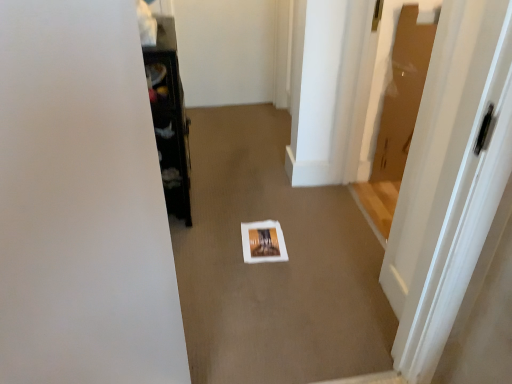
Question: From a real-world perspective, is white glossy door at center right above or below white paper at center?

Choices:
 (A) above
 (B) below

Answer: (A)

Question: In terms of height, does white glossy door at center right look taller or shorter compared to white paper at center?

Choices:
 (A) tall
 (B) short

Answer: (A)

Question: Which object is the closest to the white glossy door at center right?

Choices:
 (A) white paper at center
 (B) black glossy cabinet at left

Answer: (A)

Question: Estimate the real-world distances between objects in this image. Which object is closer to the white paper at center?

Choices:
 (A) black glossy cabinet at left
 (B) white glossy door at center right

Answer: (A)